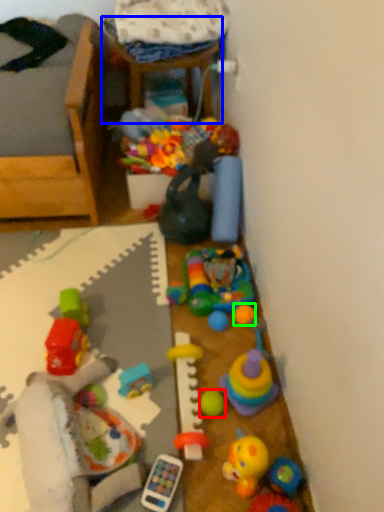
Question: Which is nearer to the toy (highlighted by a red box)? furniture (highlighted by a blue box) or toy (highlighted by a green box).

Choices:
 (A) furniture
 (B) toy

Answer: (B)